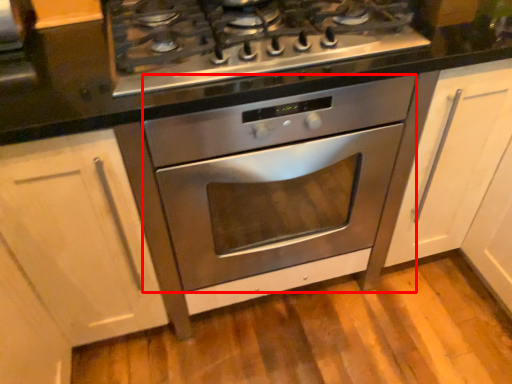
Question: From the image, what is the correct spatial relationship of oven (annotated by the red box) in relation to counter top?

Choices:
 (A) left
 (B) right

Answer: (B)